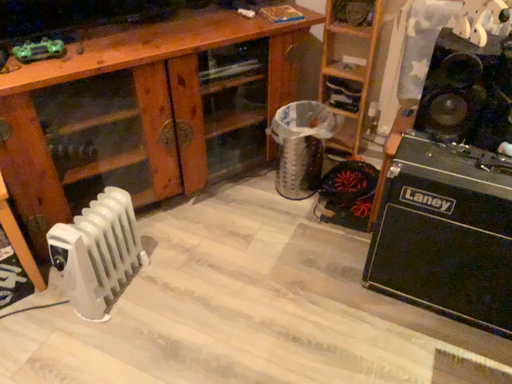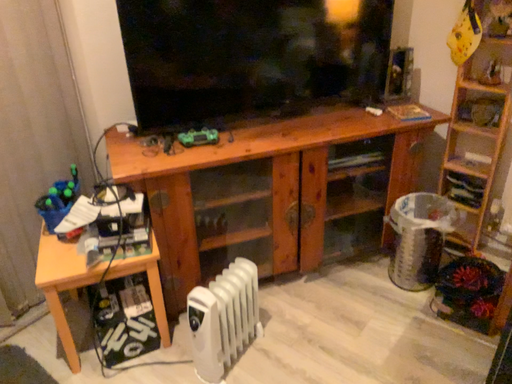
Question: How did the camera likely rotate when shooting the video?

Choices:
 (A) rotated upward
 (B) rotated downward

Answer: (A)